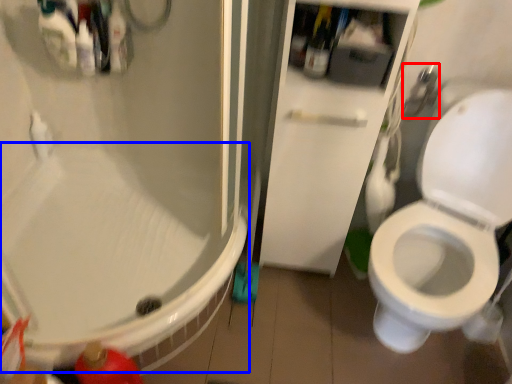
Question: Which object appears closest to the camera in this image, shower (highlighted by a red box) or bath (highlighted by a blue box)?

Choices:
 (A) shower
 (B) bath

Answer: (B)